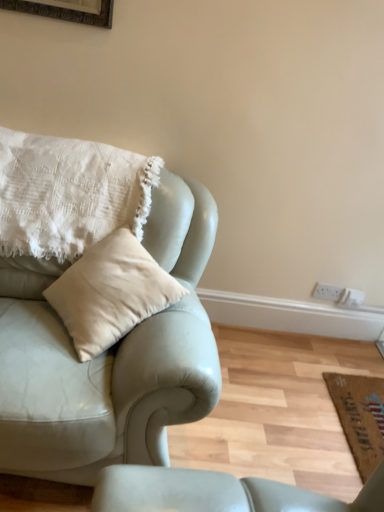
Question: Could you tell me if brown woven mat at lower right is facing white textured pillow at upper left?

Choices:
 (A) yes
 (B) no

Answer: (B)

Question: Can you confirm if brown woven mat at lower right is taller than white textured pillow at upper left?

Choices:
 (A) yes
 (B) no

Answer: (B)

Question: From a real-world perspective, is brown woven mat at lower right located higher than white textured pillow at upper left?

Choices:
 (A) yes
 (B) no

Answer: (B)

Question: Is brown woven mat at lower right at the left side of white textured pillow at upper left?

Choices:
 (A) yes
 (B) no

Answer: (B)

Question: Is brown woven mat at lower right looking in the opposite direction of white textured pillow at upper left?

Choices:
 (A) no
 (B) yes

Answer: (A)

Question: Is matte leather couch at left taller or shorter than brown woven mat at lower right?

Choices:
 (A) short
 (B) tall

Answer: (B)

Question: Visually, is matte leather couch at left positioned to the left or to the right of brown woven mat at lower right?

Choices:
 (A) right
 (B) left

Answer: (B)

Question: From a real-world perspective, is matte leather couch at left above or below brown woven mat at lower right?

Choices:
 (A) below
 (B) above

Answer: (B)

Question: From the image's perspective, relative to brown woven mat at lower right, is matte leather couch at left above or below?

Choices:
 (A) below
 (B) above

Answer: (B)

Question: Considering their positions, is brown woven mat at lower right located in front of or behind white textured pillow at upper left?

Choices:
 (A) behind
 (B) front

Answer: (A)

Question: In terms of width, does brown woven mat at lower right look wider or thinner when compared to white textured pillow at upper left?

Choices:
 (A) thin
 (B) wide

Answer: (A)

Question: From the image's perspective, is brown woven mat at lower right above or below white textured pillow at upper left?

Choices:
 (A) below
 (B) above

Answer: (A)

Question: From a real-world perspective, is brown woven mat at lower right physically located above or below white textured pillow at upper left?

Choices:
 (A) below
 (B) above

Answer: (A)

Question: Looking at the image, does white textured pillow at upper left seem bigger or smaller compared to brown woven mat at lower right?

Choices:
 (A) big
 (B) small

Answer: (A)

Question: Based on their positions, is white textured pillow at upper left located to the left or right of brown woven mat at lower right?

Choices:
 (A) right
 (B) left

Answer: (B)